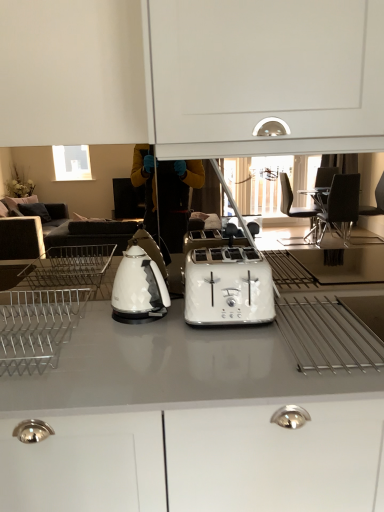
This screenshot has width=384, height=512. I want to click on vacant space that is in between white glossy toaster at center and white glossy electric kettle at left, so click(160, 327).